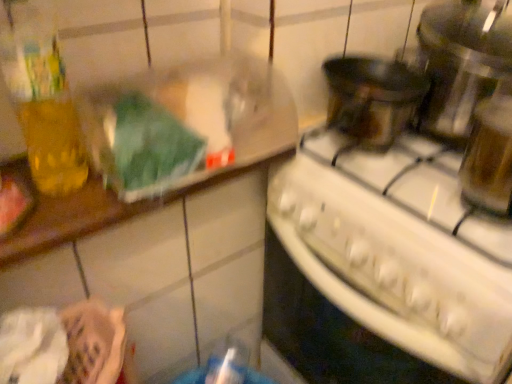
Question: Based on their sizes in the image, would you say metallic silver pot at upper right is bigger or smaller than white glossy stove at center?

Choices:
 (A) big
 (B) small

Answer: (B)

Question: Is metallic silver pot at upper right inside or outside of white glossy stove at center?

Choices:
 (A) inside
 (B) outside

Answer: (B)

Question: From the image's perspective, is metallic silver pot at upper right above or below white glossy stove at center?

Choices:
 (A) below
 (B) above

Answer: (B)

Question: Looking at their shapes, would you say white glossy stove at center is wider or thinner than metallic silver pot at upper right?

Choices:
 (A) thin
 (B) wide

Answer: (B)

Question: In the image, is white glossy stove at center positioned in front of or behind metallic silver pot at upper right?

Choices:
 (A) behind
 (B) front

Answer: (B)

Question: Is white glossy stove at center inside or outside of metallic silver pot at upper right?

Choices:
 (A) inside
 (B) outside

Answer: (B)

Question: From their relative heights in the image, would you say white glossy stove at center is taller or shorter than metallic silver pot at upper right?

Choices:
 (A) tall
 (B) short

Answer: (A)